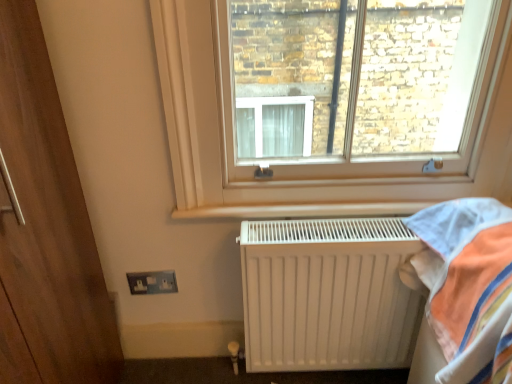
Question: From a real-world perspective, relative to white matte radiator at lower right, is metallic silver electrical outlet at lower left vertically above or below?

Choices:
 (A) below
 (B) above

Answer: (A)

Question: Choose the correct answer: Is metallic silver electrical outlet at lower left inside white matte radiator at lower right or outside it?

Choices:
 (A) outside
 (B) inside

Answer: (A)

Question: Considering the real-world distances, which object is closest to the white plastic window at upper center?

Choices:
 (A) metallic silver electrical outlet at lower left
 (B) white matte radiator at lower right

Answer: (B)

Question: Estimate the real-world distances between objects in this image. Which object is farther from the metallic silver electrical outlet at lower left?

Choices:
 (A) white matte radiator at lower right
 (B) white plastic window at upper center

Answer: (B)